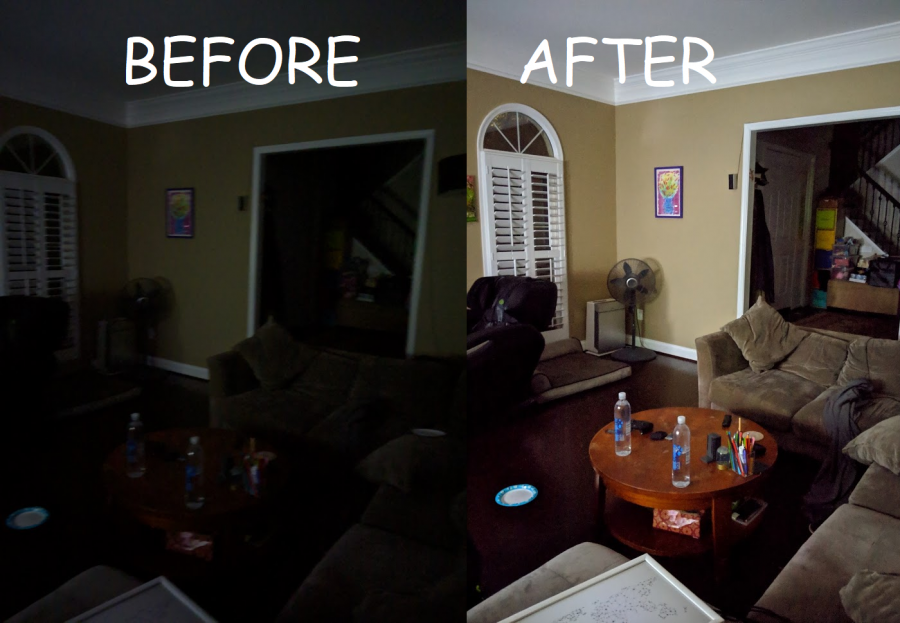
This screenshot has width=900, height=623. What are the coordinates of `before after photo of room` in the screenshot? It's located at (275, 65), (546, 75).